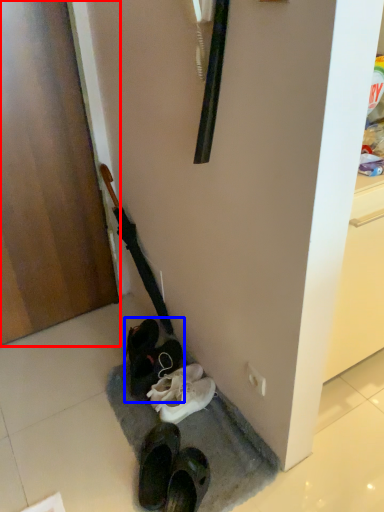
Question: Which of the following is the farthest to the observer, door (highlighted by a red box) or footwear (highlighted by a blue box)?

Choices:
 (A) door
 (B) footwear

Answer: (B)